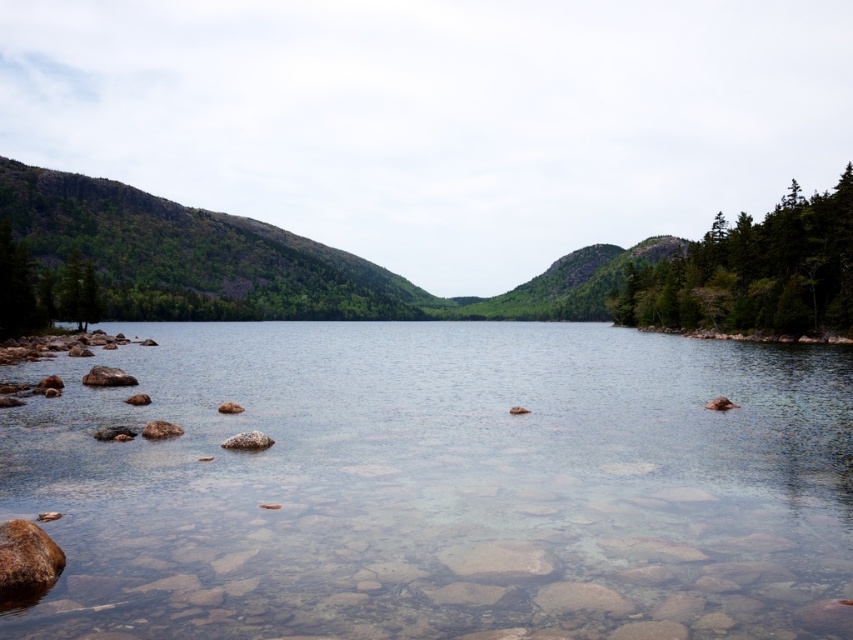
Question: In this image, where is brown rough rock at lower left located relative to green matte tree at left?

Choices:
 (A) above
 (B) below

Answer: (B)

Question: Is green rocky mountain at left positioned before green matte tree at left?

Choices:
 (A) no
 (B) yes

Answer: (A)

Question: Which is nearer to the green matte tree at left?

Choices:
 (A) brown rock shoreline at lower right
 (B) green matte tree at right

Answer: (A)

Question: Based on their relative distances, which object is farther from the brown rough rock at lower left?

Choices:
 (A) smooth gray rock at lower center
 (B) brown rock shoreline at lower right
 (C) green rocky mountain at left
 (D) clear stone water at center

Answer: (C)

Question: Where is green matte tree at right located in relation to brown rock shoreline at lower right in the image?

Choices:
 (A) below
 (B) above

Answer: (B)

Question: Which object is the closest to the green rocky mountain at left?

Choices:
 (A) smooth gray rock at lower center
 (B) smooth gray rock at lower left
 (C) brown rough rock at lower left

Answer: (C)